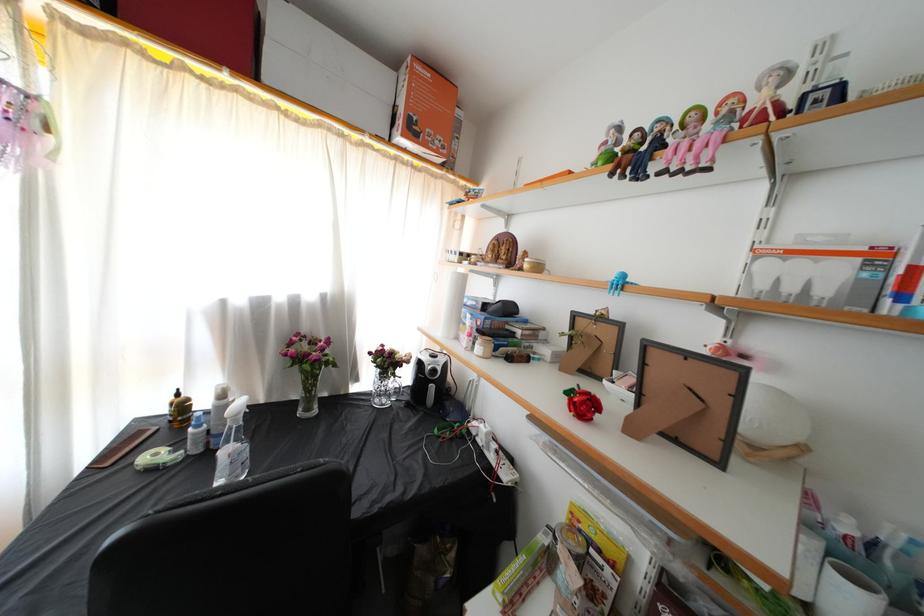
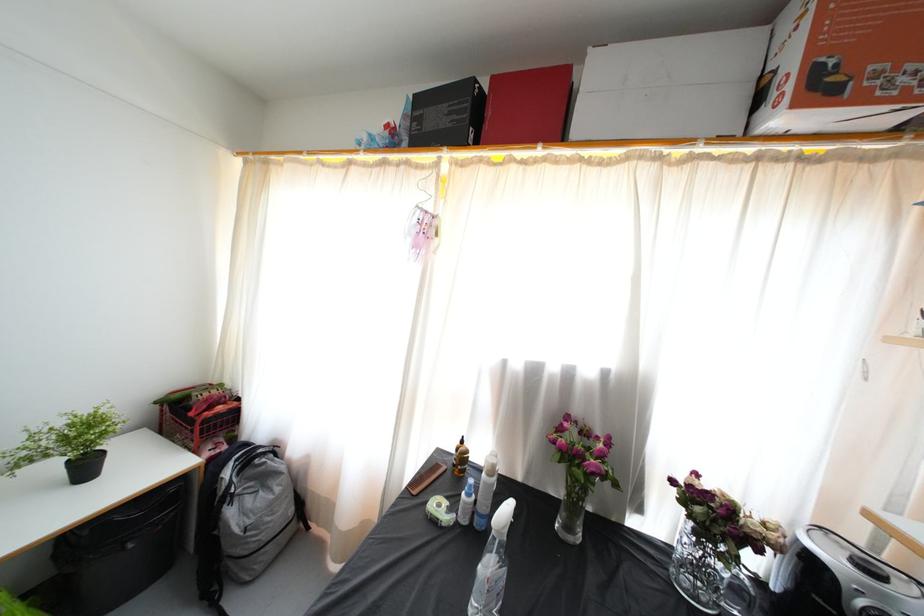
Question: How did the camera likely rotate?

Choices:
 (A) Left
 (B) Right
 (C) Up
 (D) Down

Answer: (A)